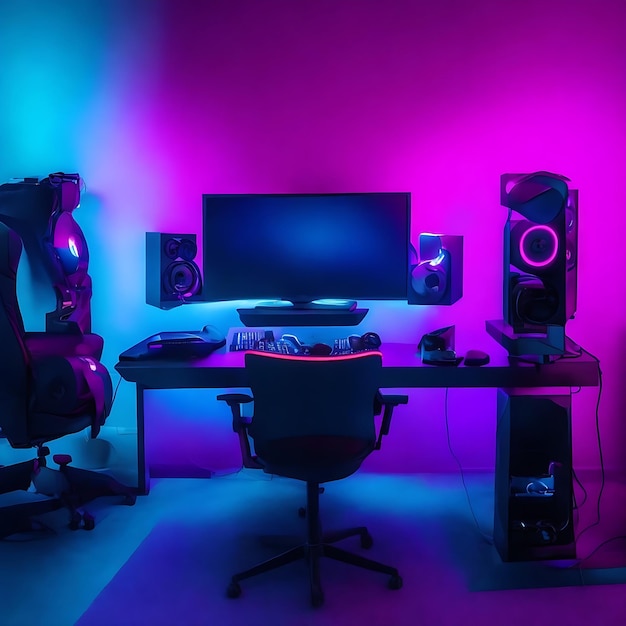
The image size is (626, 626). Find the location of `computer chair height adjuster`. computer chair height adjuster is located at coordinates (317, 493), (44, 451), (66, 458).